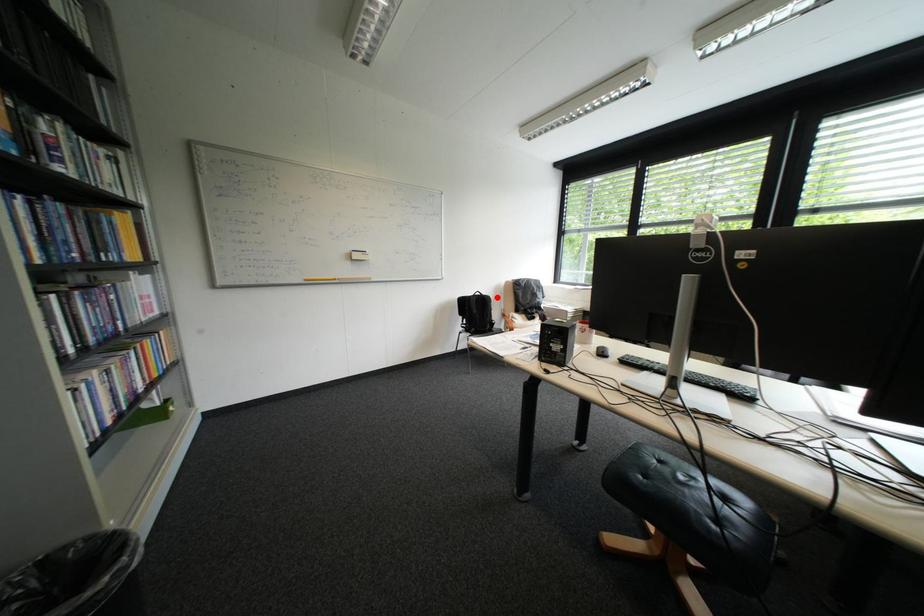
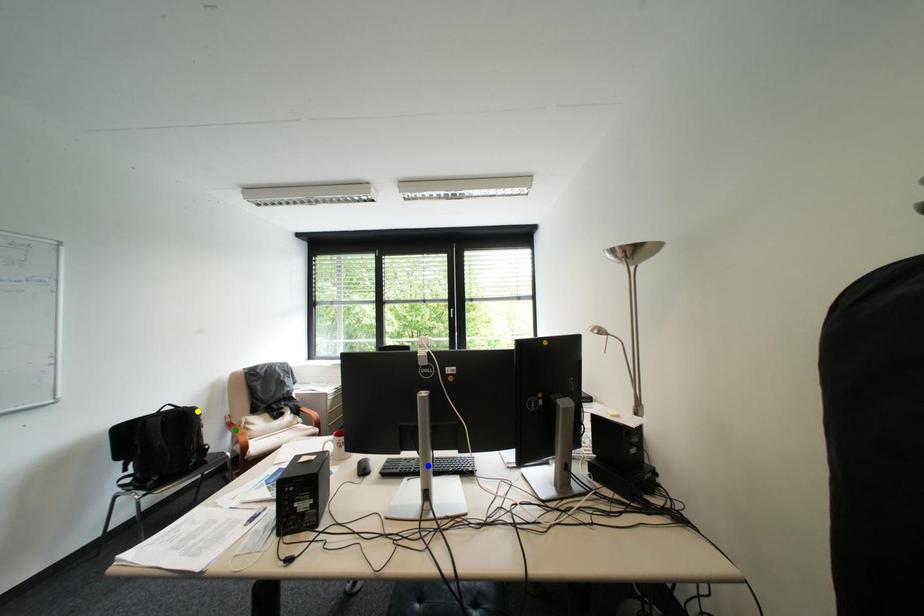
Question: I am providing you with two images of the same scene from different viewpoints. A red point is marked on the first image. You are given multiple points on the second image. Which point in image 2 represents the same 3d spot as the red point in image 1?

Choices:
 (A) blue point
 (B) green point
 (C) yellow point

Answer: (C)